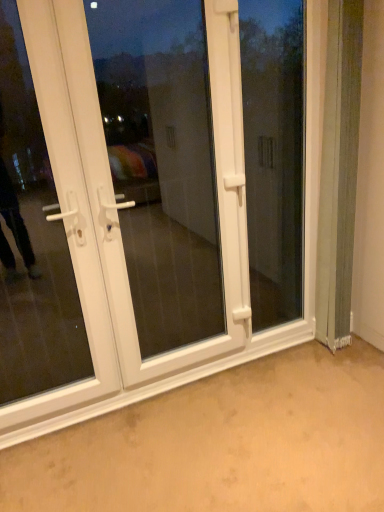
Identify the location of free area below white plastic screen door at center (from a real-world perspective). (182, 375).